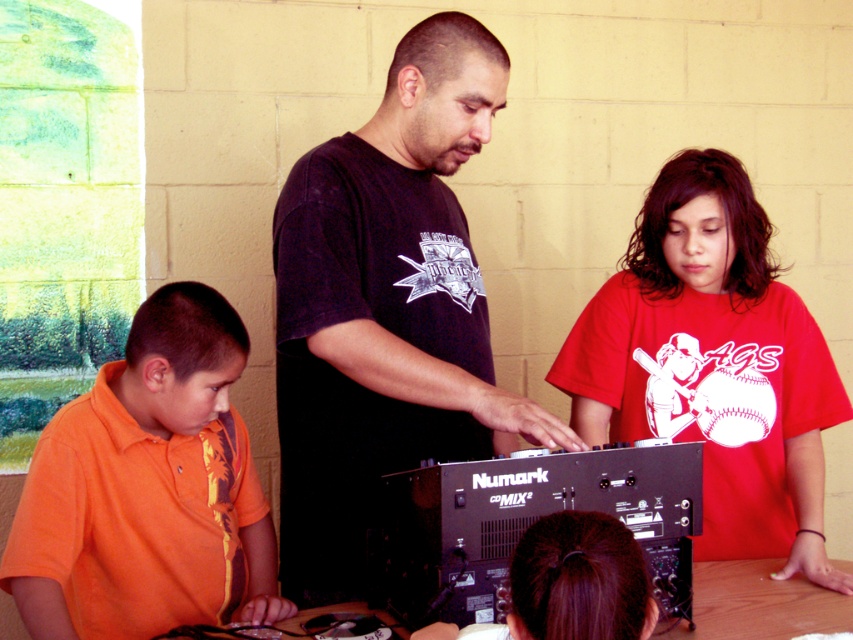
Question: Which of the following is the farthest from the observer?

Choices:
 (A) red matte shirt at center
 (B) black matte shirt at center
 (C) wooden table at center
 (D) orange cotton shirt at lower left

Answer: (A)

Question: Where is black matte shirt at center located in relation to wooden table at center in the image?

Choices:
 (A) above
 (B) below

Answer: (A)

Question: Does orange cotton shirt at lower left come in front of wooden table at center?

Choices:
 (A) no
 (B) yes

Answer: (B)

Question: Which of the following is the farthest from the observer?

Choices:
 (A) (468, 422)
 (B) (202, 422)
 (C) (734, 605)

Answer: (A)

Question: Based on their relative distances, which object is farther from the wooden table at center?

Choices:
 (A) black matte shirt at center
 (B) red matte shirt at center
 (C) orange cotton shirt at lower left

Answer: (C)

Question: Does red matte shirt at center have a smaller size compared to wooden table at center?

Choices:
 (A) yes
 (B) no

Answer: (B)